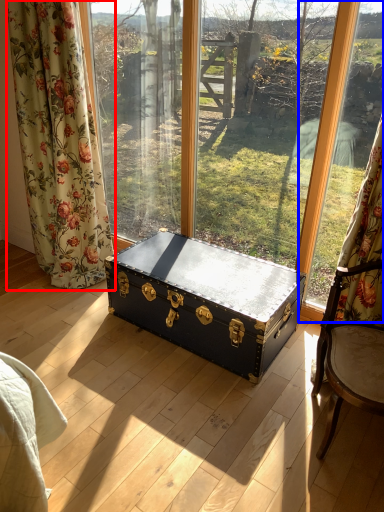
Question: Which of the following is the farthest to the observer, curtain (highlighted by a red box) or window frame (highlighted by a blue box)?

Choices:
 (A) curtain
 (B) window frame

Answer: (A)